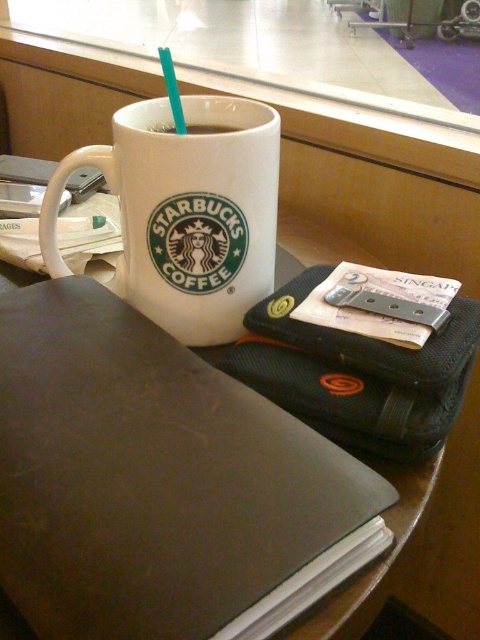
You are a barista preparing drinks in a cafe. You have two cups on the counter, the white matte starbucks coffee cup at upper center and the white glossy mug at upper center. Which cup is positioned to the left?

The white matte starbucks coffee cup at upper center is to the left of the white glossy mug at upper center.

You are a customer at this location and want to pick up the item closest to you. Which of the two points, point (x=266, y=484) or point (x=168, y=131), should you reach for?

Point (x=266, y=484) is closer to the camera than point (x=168, y=131), so you should reach for point (x=266, y=484).